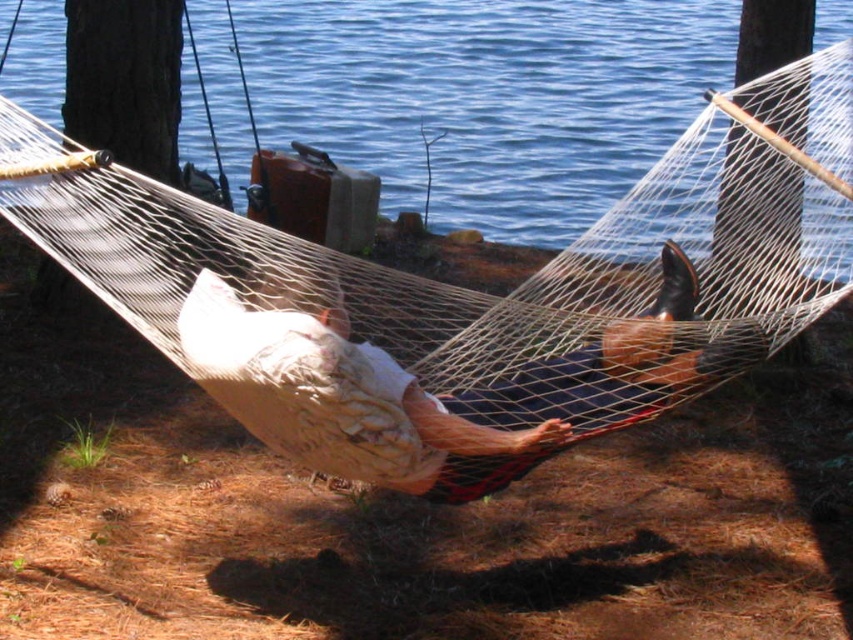
How far apart are blue water at center and white cotton shirt at center?

The distance of blue water at center from white cotton shirt at center is 4.60 meters.

Is blue water at center below white cotton shirt at center?

No.

Image resolution: width=853 pixels, height=640 pixels. What do you see at coordinates (488, 97) in the screenshot? I see `blue water at center` at bounding box center [488, 97].

Locate an element on the screen. The image size is (853, 640). blue water at center is located at coordinates (488, 97).